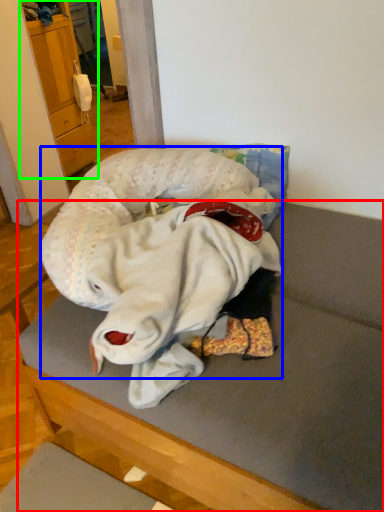
Question: Estimate the real-world distances between objects in this image. Which object is farther from furniture (highlighted by a red box), baby (highlighted by a blue box) or cabinetry (highlighted by a green box)?

Choices:
 (A) baby
 (B) cabinetry

Answer: (B)